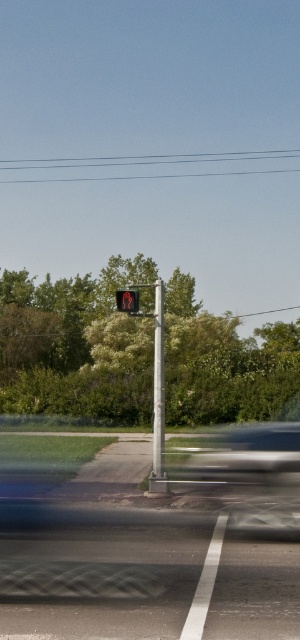
You are a delivery driver approaching the intersection and see the silver metallic pole at center and the red matte pedestrian signal at center. Which object is positioned higher from the ground?

The red matte pedestrian signal at center is positioned higher from the ground than the silver metallic pole at center because the silver metallic pole at center is located below it.

You are a delivery person standing at the edge of the road. You need to place a box on the silver metallic pole at center, but you can only reach up to 1.8 meters. Can you reach the red matte pedestrian signal at center to check its status without a ladder?

The silver metallic pole at center is 3.74 meters from red matte pedestrian signal at center, so the distance between them is too large for you to reach the red matte pedestrian signal at center from the pole without a ladder.

Based on the scene description, where is the silver metallic pole at center located in the image?

The silver metallic pole at center is located at point (158, 397) in the image.